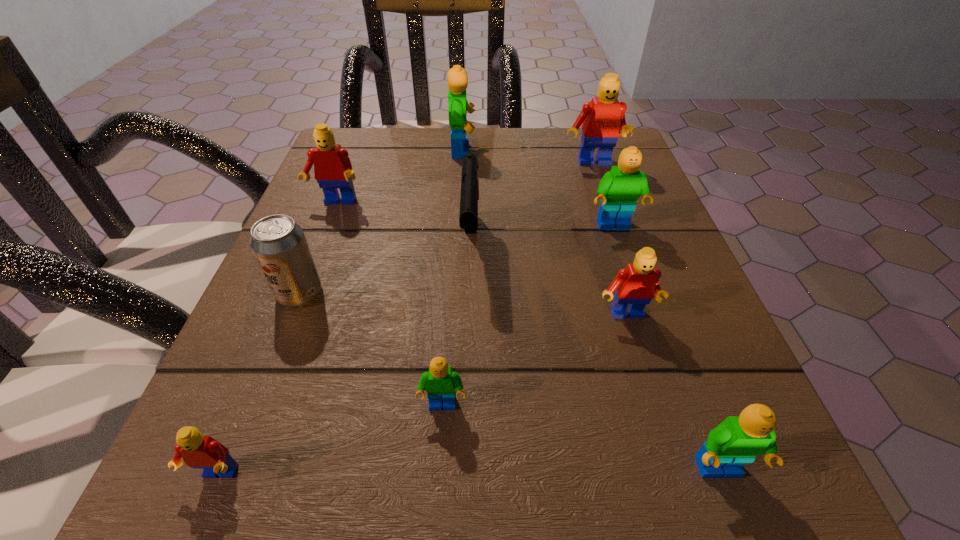
What are the coordinates of `free spot that satisfies the following two spatial constraints: 1. on the face of the biggest green Lego; 2. on the face of the smallest green Lego` in the screenshot? It's located at [x=450, y=406].